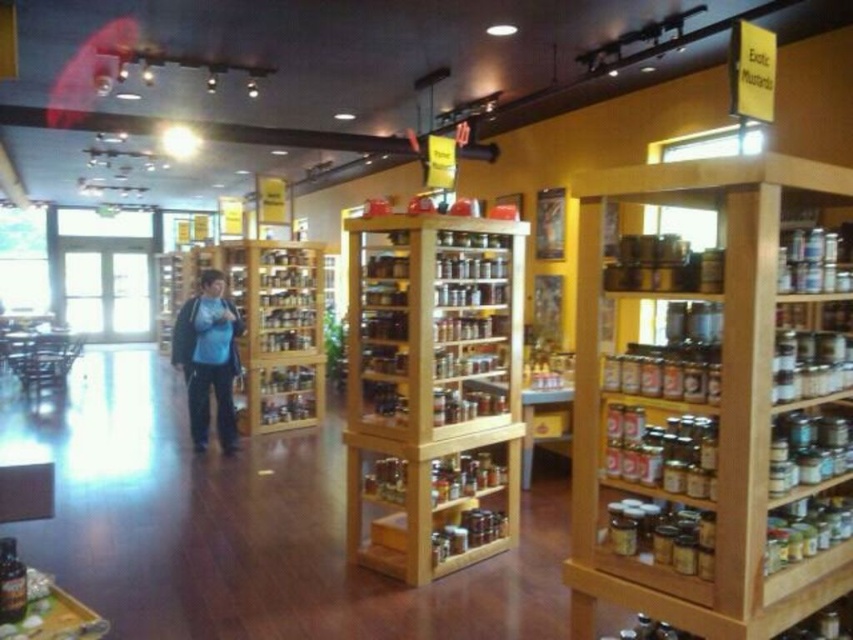
Does wooden shelves at right have a lesser width compared to blue fabric shirt at center?

No.

I want to click on wooden shelves at right, so click(714, 404).

Is wooden spice rack at center bigger than blue fabric shirt at center?

Correct, wooden spice rack at center is larger in size than blue fabric shirt at center.

Between point (372, 524) and point (207, 417), which one is positioned in front?

Positioned in front is point (372, 524).

The width and height of the screenshot is (853, 640). I want to click on wooden spice rack at center, so click(x=432, y=392).

The width and height of the screenshot is (853, 640). In order to click on wooden spice rack at center in this screenshot , I will do `click(432, 392)`.

Who is taller, wooden shelves at right or wooden spice rack at center?

With more height is wooden spice rack at center.

Between point (848, 397) and point (386, 353), which one is positioned in front?

Positioned in front is point (848, 397).

Find the location of a particular element. The width and height of the screenshot is (853, 640). wooden shelves at right is located at coordinates (714, 404).

At what (x,y) coordinates should I click in order to perform the action: click on wooden shelves at right. Please return your answer as a coordinate pair (x, y). The width and height of the screenshot is (853, 640). Looking at the image, I should click on (714, 404).